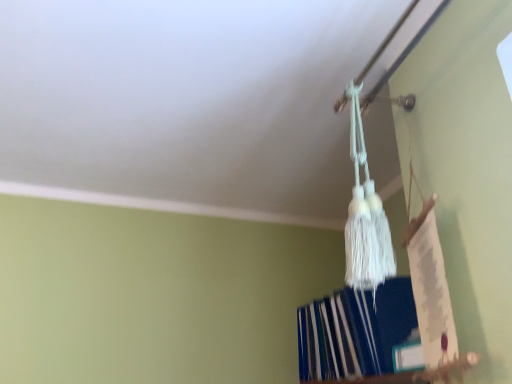
Question: Is white tassel at upper center taller than white matte trim at upper center?

Choices:
 (A) yes
 (B) no

Answer: (A)

Question: Is white matte trim at upper center located within white tassel at upper center?

Choices:
 (A) yes
 (B) no

Answer: (B)

Question: From the image's perspective, is white tassel at upper center beneath white matte trim at upper center?

Choices:
 (A) yes
 (B) no

Answer: (A)

Question: Is the depth of white tassel at upper center greater than that of white matte trim at upper center?

Choices:
 (A) yes
 (B) no

Answer: (B)

Question: From a real-world perspective, is white tassel at upper center physically above white matte trim at upper center?

Choices:
 (A) no
 (B) yes

Answer: (A)

Question: Is white tassel at upper center not close to white matte trim at upper center?

Choices:
 (A) no
 (B) yes

Answer: (A)

Question: From the image's perspective, does white matte trim at upper center appear higher than white tassel at upper center?

Choices:
 (A) no
 (B) yes

Answer: (B)

Question: Does white matte trim at upper center have a lesser height compared to white tassel at upper center?

Choices:
 (A) yes
 (B) no

Answer: (A)

Question: Does white matte trim at upper center come in front of white tassel at upper center?

Choices:
 (A) no
 (B) yes

Answer: (A)

Question: Does white matte trim at upper center have a smaller size compared to white tassel at upper center?

Choices:
 (A) yes
 (B) no

Answer: (A)

Question: Is white matte trim at upper center turned away from white tassel at upper center?

Choices:
 (A) yes
 (B) no

Answer: (B)

Question: Does white matte trim at upper center have a greater width compared to white tassel at upper center?

Choices:
 (A) no
 (B) yes

Answer: (A)

Question: In the image, is white tassel at upper center on the left side or the right side of white matte trim at upper center?

Choices:
 (A) left
 (B) right

Answer: (B)